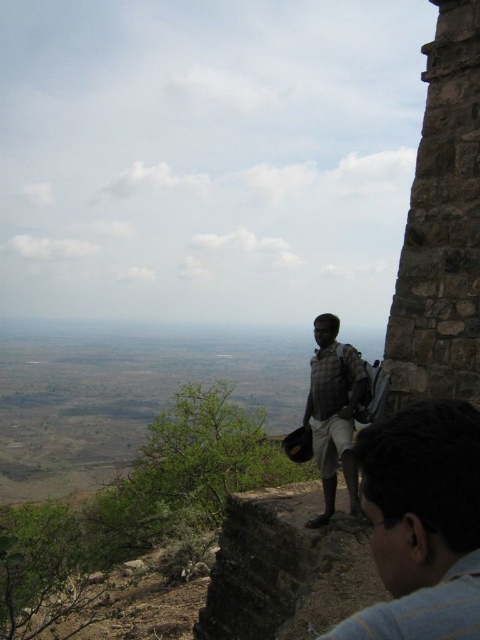
You are a photographer planning to capture a wide landscape shot. You notice two shirts in the scene, the blue denim shirt at lower right and the checkered fabric shirt at center. Which shirt would you need to move closer to ensure it appears larger in the photo?

The blue denim shirt at lower right has a lesser width compared to the checkered fabric shirt at center, so to make it appear larger in the photo, you would need to move the blue denim shirt at lower right closer to the camera.

You are a hiker who wants to take a photo of both the blue denim shirt at lower right and the checkered fabric shirt at center. Which one should you focus on first to ensure they are both in clear view?

You should focus on the blue denim shirt at lower right first because it is closer to the viewer than the checkered fabric shirt at center, so adjusting focus from near to far will help both be in clear view.

You are a hiker who has just reached the top of a hill and sees the blue denim shirt at lower right and the checkered fabric shirt at center. Which shirt is closer to the edge of the rocky outcrop?

The blue denim shirt at lower right is closer to the edge of the rocky outcrop because it is positioned under the checkered fabric shirt at center, indicating it is lower in the scene and thus nearer to the edge.